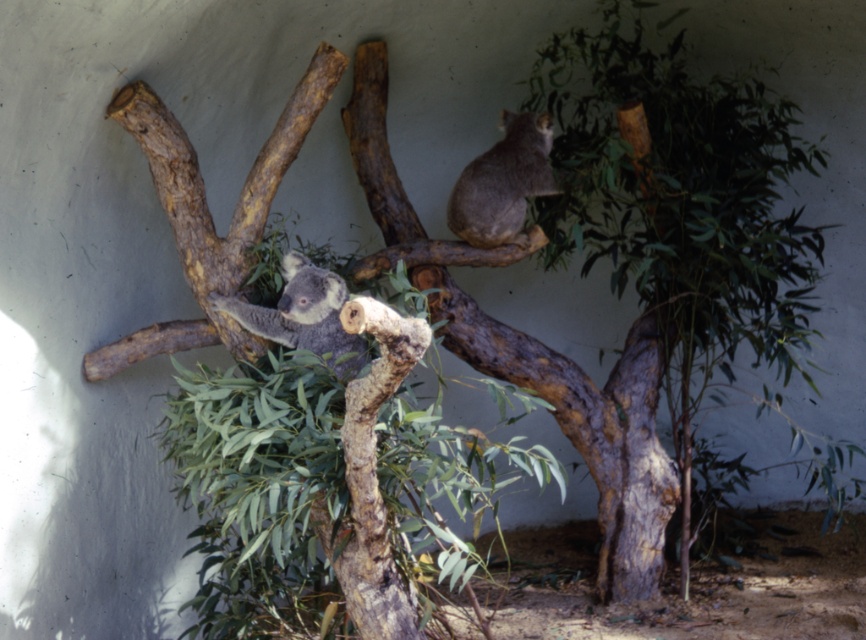
Question: Among these objects, which one is farthest from the camera?

Choices:
 (A) gray furry koala at center
 (B) gray furry koala at upper right

Answer: (B)

Question: Which of the following is the closest to the observer?

Choices:
 (A) gray furry koala at center
 (B) gray furry koala at upper right

Answer: (A)

Question: Does gray furry koala at upper right have a larger size compared to gray furry koala at center?

Choices:
 (A) no
 (B) yes

Answer: (B)

Question: Does gray furry koala at upper right appear under gray furry koala at center?

Choices:
 (A) yes
 (B) no

Answer: (B)

Question: Does gray furry koala at upper right lie behind gray furry koala at center?

Choices:
 (A) no
 (B) yes

Answer: (B)